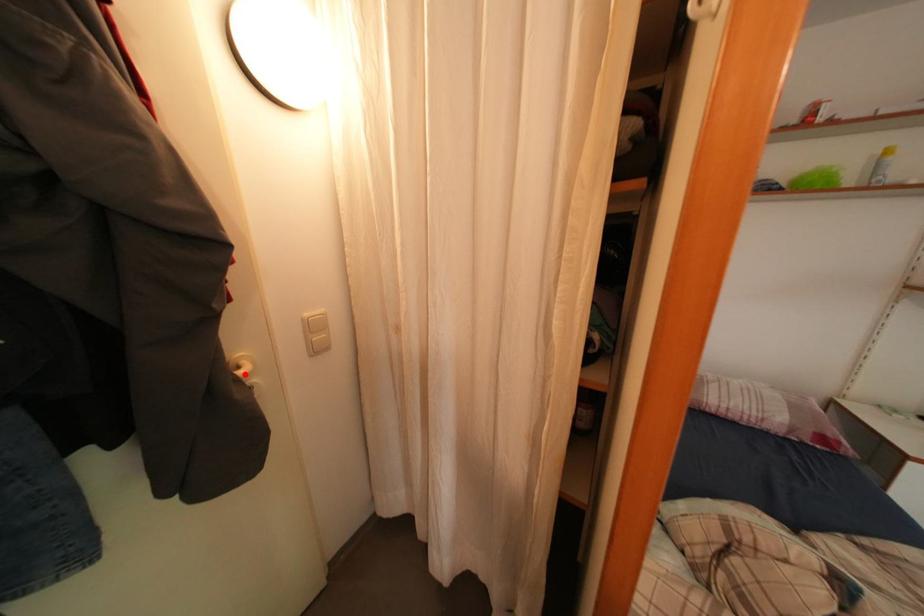
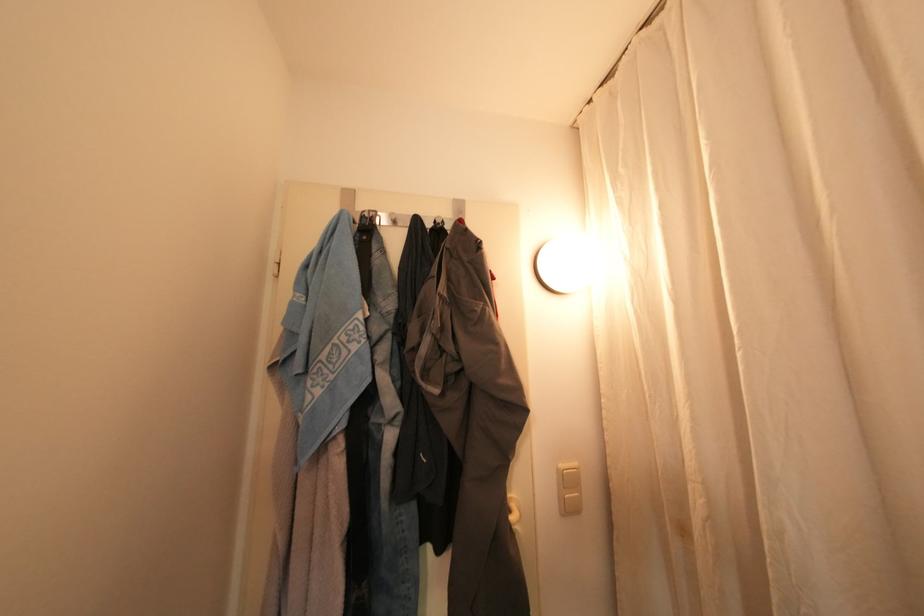
Find the pixel in the second image that matches the highlighted location in the first image.

(517, 519)